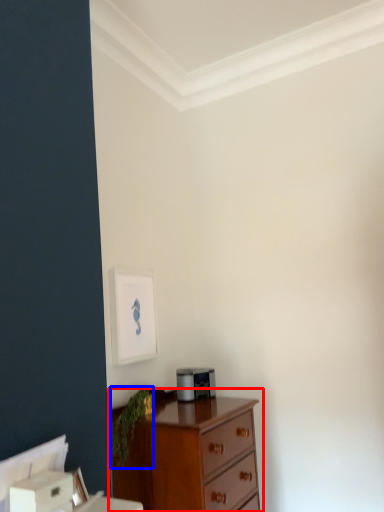
Question: Which of the following is the closest to the observer, chest of drawers (highlighted by a red box) or plant (highlighted by a blue box)?

Choices:
 (A) chest of drawers
 (B) plant

Answer: (A)